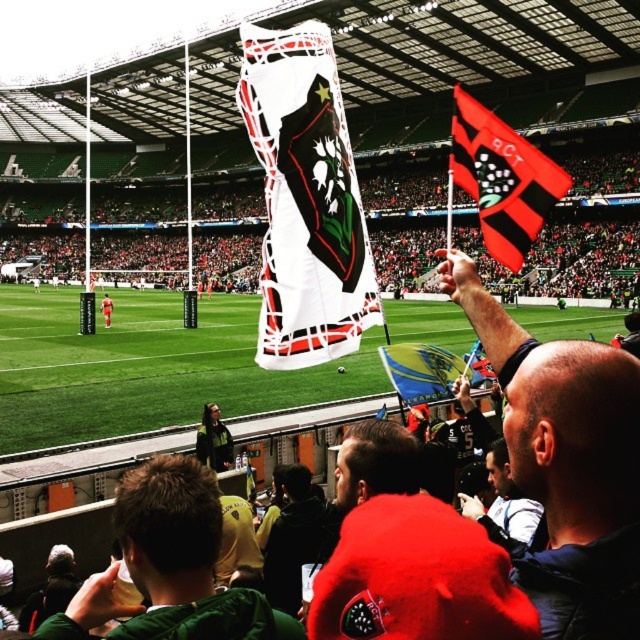
You are a photographer at the rugby stadium and want to capture both the white matte flag at center and the red fabric flag at upper right in a single shot. Which flag should you focus on first to ensure both are in frame?

The white matte flag at center is shorter than the red fabric flag at upper right, so focusing on the taller red fabric flag at upper right first would help ensure both flags are captured in the frame.

In the scene shown: You are a photographer at the rugby stadium. You want to take a photo that includes both the white fabric banner at upper center and the red fabric shirt at center. Which object should you focus on first to ensure both are in the frame?

You should focus on the red fabric shirt at center first because the white fabric banner at upper center is located above it, so adjusting the frame to include the lower object first will help capture both.

You are a photographer standing at the edge of the rugby field. You want to take a photo that includes both the fan with the large flag and the fan with the smaller flag. The fan with the large flag is at point (547,374) and the fan with the smaller flag is at point (346,442). Which fan should you focus on first to ensure both are in the frame?

You should focus on the fan at point (547,374) first because it is closer to the viewer than the fan at point (346,442). This ensures both fans are within the frame when adjusting the camera.